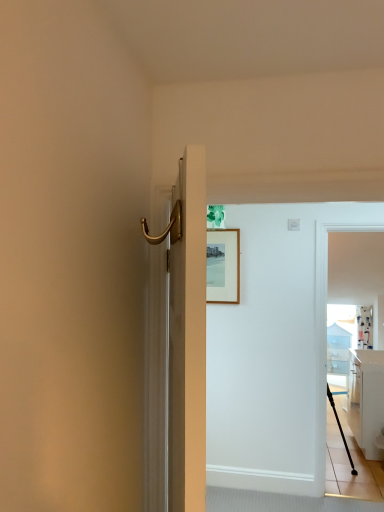
I want to click on free spot below white glossy screen door at right (from a real-world perspective), so click(359, 494).